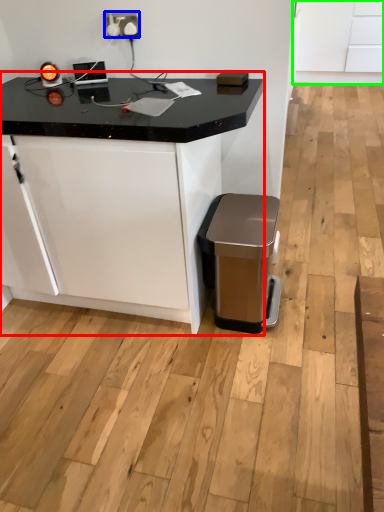
Question: Which is farther away from table (highlighted by a red box)? electric outlet (highlighted by a blue box) or cabinetry (highlighted by a green box)?

Choices:
 (A) electric outlet
 (B) cabinetry

Answer: (B)